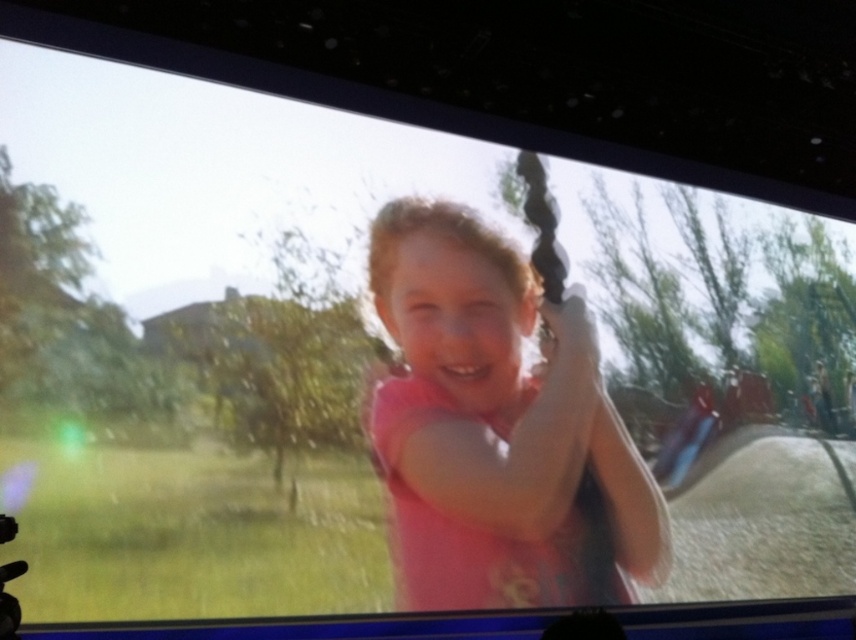
Question: Does pink matte shirt at center have a smaller size compared to matte plastic bag at lower right?

Choices:
 (A) yes
 (B) no

Answer: (B)

Question: Which point is farther from the camera taking this photo?

Choices:
 (A) (667, 477)
 (B) (551, 317)

Answer: (A)

Question: Which point is farther to the camera?

Choices:
 (A) (486, 323)
 (B) (697, 406)

Answer: (B)

Question: Does pink matte shirt at center have a lesser width compared to matte plastic bag at lower right?

Choices:
 (A) no
 (B) yes

Answer: (A)

Question: In this image, where is pink matte shirt at center located relative to matte plastic bag at lower right?

Choices:
 (A) left
 (B) right

Answer: (A)